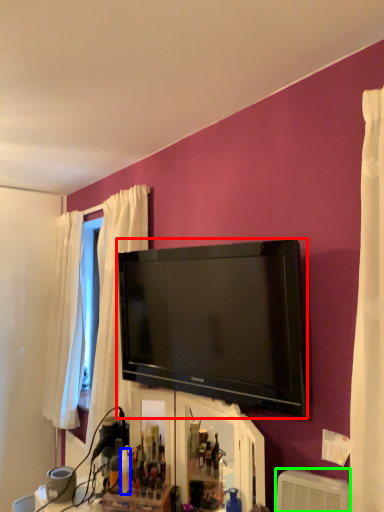
Question: Which object is positioned farthest from television (highlighted by a red box)? Select from toiletry (highlighted by a blue box) and air conditioner (highlighted by a green box).

Choices:
 (A) toiletry
 (B) air conditioner

Answer: (A)